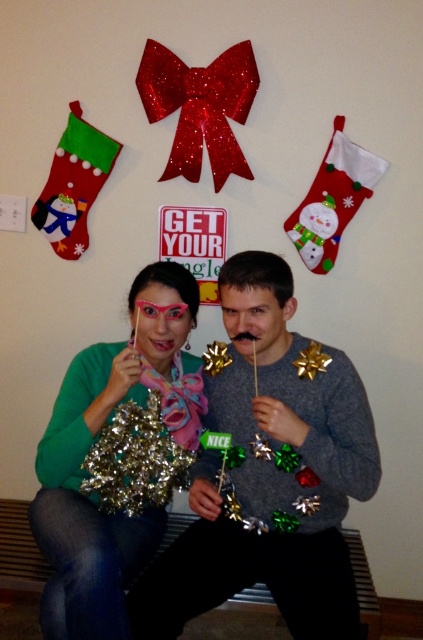
The width and height of the screenshot is (423, 640). Describe the element at coordinates (269, 474) in the screenshot. I see `gray sweater at center` at that location.

Does gray sweater at center appear on the left side of metallic gold tinsel at left?

No, gray sweater at center is not to the left of metallic gold tinsel at left.

What do you see at coordinates (269, 474) in the screenshot? The image size is (423, 640). I see `gray sweater at center` at bounding box center [269, 474].

At what (x,y) coordinates should I click in order to perform the action: click on gray sweater at center. Please return your answer as a coordinate pair (x, y). The width and height of the screenshot is (423, 640). Looking at the image, I should click on (269, 474).